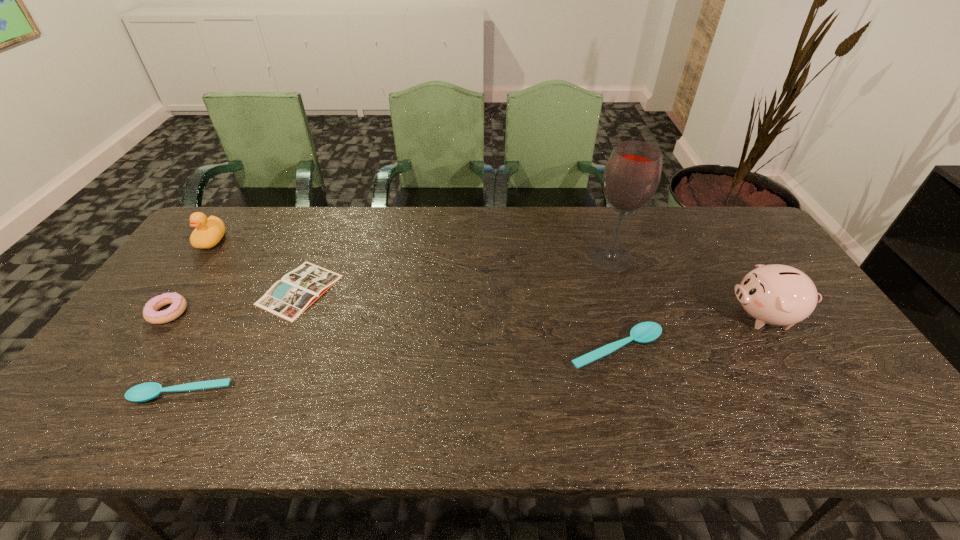
I want to click on spot to insert another spoon for uniform distribution, so click(408, 370).